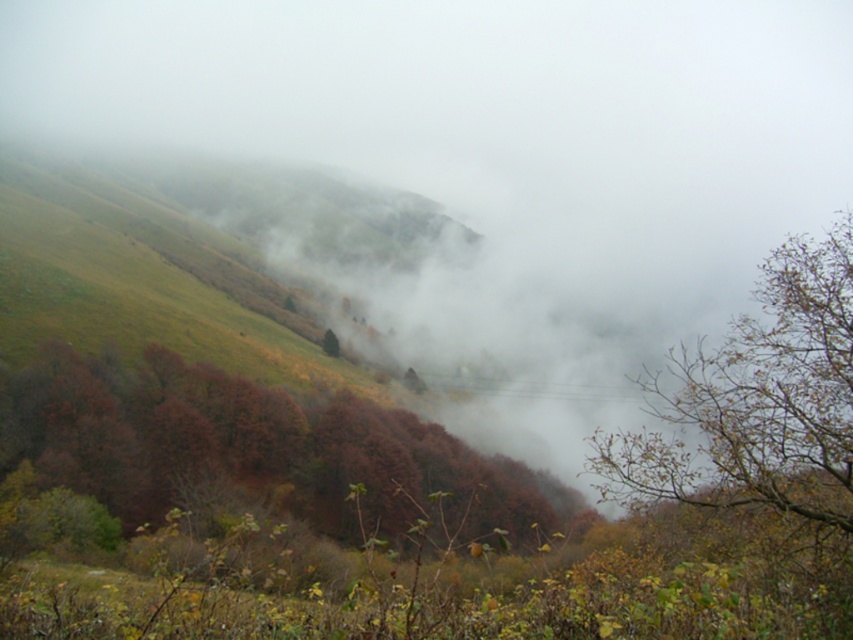
Does autumn leaves at center appear over green matte tree at center?

No, autumn leaves at center is not above green matte tree at center.

Between autumn leaves at center and green matte tree at center, which one has more height?

autumn leaves at center is taller.

Between point (83, 420) and point (325, 340), which one is positioned behind?

The point (325, 340) is behind.

Locate an element on the screen. The height and width of the screenshot is (640, 853). autumn leaves at center is located at coordinates (251, 448).

Who is higher up, autumn leaves at center or brown leafy branches at right?

Positioned higher is brown leafy branches at right.

Does autumn leaves at center appear on the left side of brown leafy branches at right?

Yes, autumn leaves at center is to the left of brown leafy branches at right.

Is point (260, 416) positioned before point (795, 252)?

No, (260, 416) is further to viewer.

I want to click on autumn leaves at center, so click(251, 448).

Which is above, brown leafy branches at right or green matte tree at center?

brown leafy branches at right is higher up.

I want to click on brown leafy branches at right, so click(x=756, y=401).